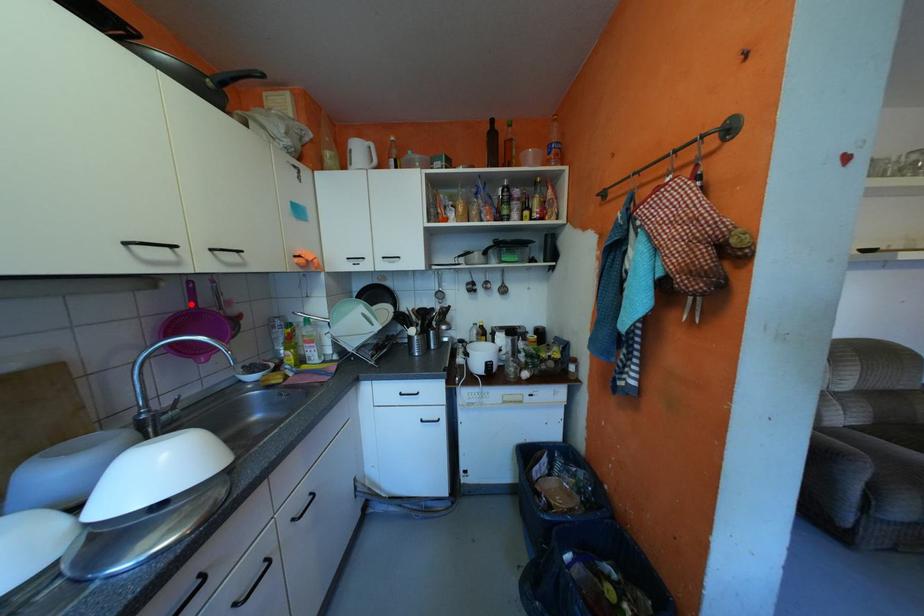
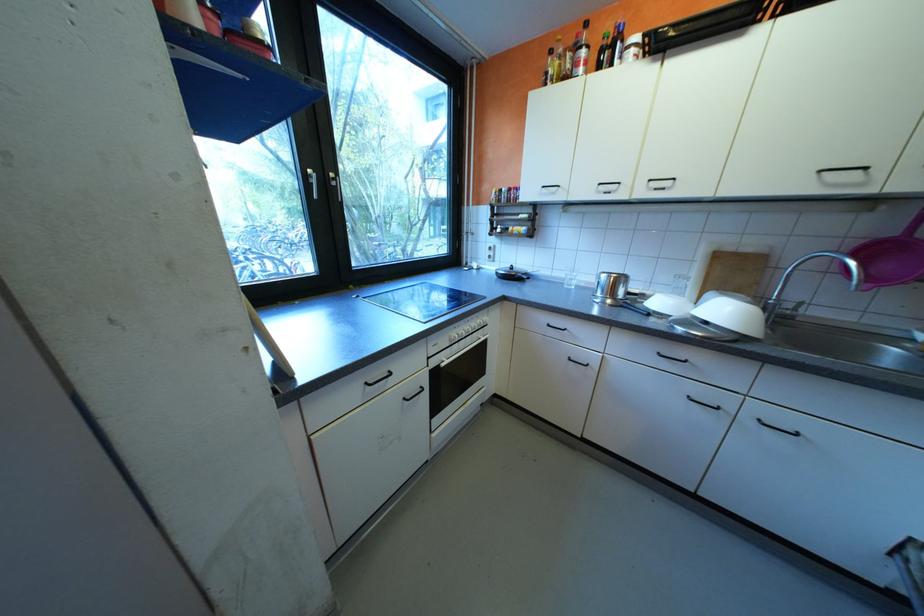
In the second image, find the point that corresponds to the highlighted location in the first image.

(906, 231)